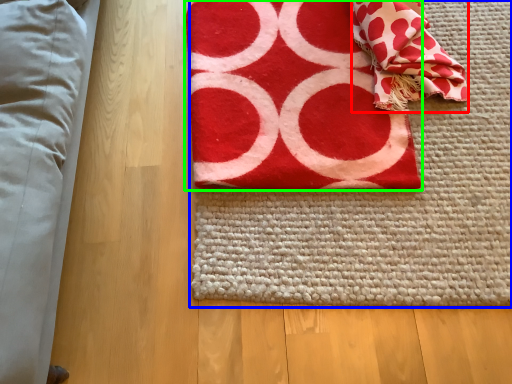
Question: Which is nearer to the blanket (highlighted by a red box)? yoga mat (highlighted by a blue box) or towel (highlighted by a green box).

Choices:
 (A) yoga mat
 (B) towel

Answer: (B)